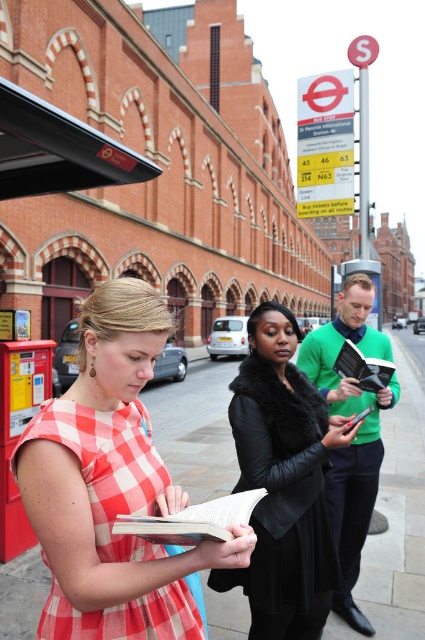
Can you confirm if black leather coat at center is smaller than checkered fabric dress at lower left?

No.

Is black leather coat at center positioned at the back of checkered fabric dress at lower left?

Yes, black leather coat at center is behind checkered fabric dress at lower left.

Who is more forward, [268,403] or [195,611]?

Point [195,611] is more forward.

Locate an element on the screen. black leather coat at center is located at coordinates (283, 483).

Who is positioned more to the right, white paper book at center or leather-bound book at center?

From the viewer's perspective, leather-bound book at center appears more on the right side.

From the picture: How distant is white paper book at center from leather-bound book at center?

white paper book at center and leather-bound book at center are 2.00 meters apart from each other.

The height and width of the screenshot is (640, 425). I want to click on white paper book at center, so click(x=192, y=520).

What do you see at coordinates (399, 508) in the screenshot? I see `paved stone sidewalk at center` at bounding box center [399, 508].

Which of these two, paved stone sidewalk at center or checkered fabric dress at lower left, stands taller?

paved stone sidewalk at center is taller.

Where is `paved stone sidewalk at center`? Image resolution: width=425 pixels, height=640 pixels. paved stone sidewalk at center is located at coordinates (399, 508).

Find the location of a particular element. The image size is (425, 640). paved stone sidewalk at center is located at coordinates tap(399, 508).